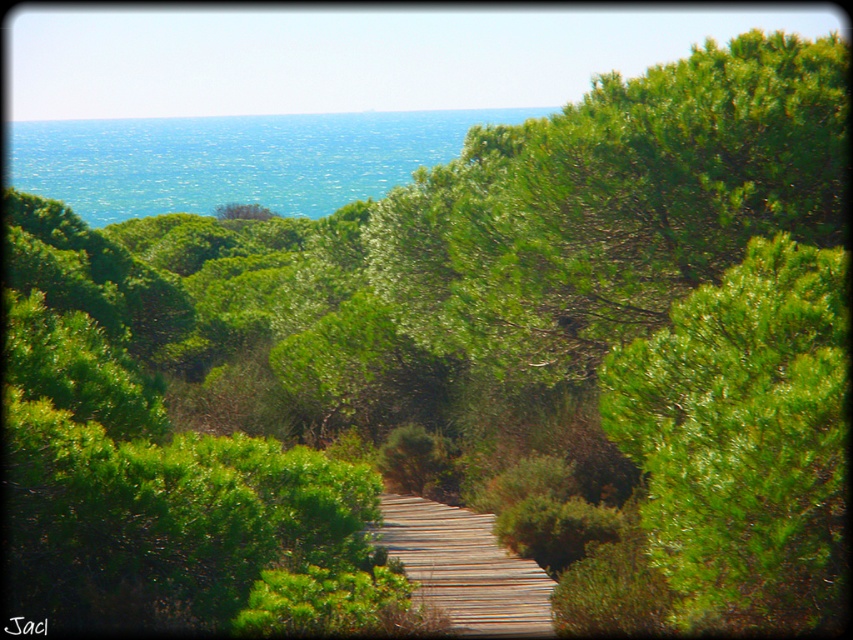
Question: Considering the relative positions of green leafy tree at upper right and wooden at center in the image provided, where is green leafy tree at upper right located with respect to wooden at center?

Choices:
 (A) left
 (B) right

Answer: (B)

Question: Can you confirm if green leafy tree at upper right is positioned above wooden at center?

Choices:
 (A) no
 (B) yes

Answer: (B)

Question: Which point is farther from the camera taking this photo?

Choices:
 (A) pos(460,541)
 (B) pos(743,448)

Answer: (A)

Question: Which of the following is the closest to the observer?

Choices:
 (A) (790, 333)
 (B) (396, 516)

Answer: (A)

Question: Does green leafy tree at upper right have a lesser width compared to wooden at center?

Choices:
 (A) yes
 (B) no

Answer: (A)